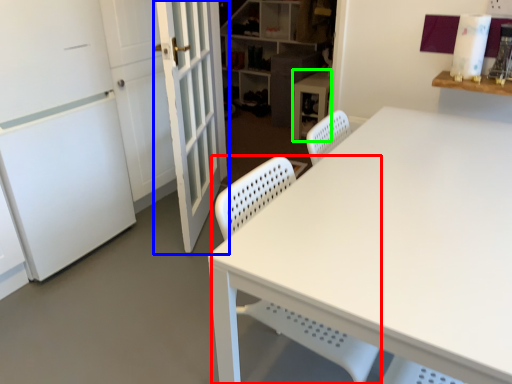
Question: Estimate the real-world distances between objects in this image. Which object is closer to swivel chair (highlighted by a red box), door (highlighted by a blue box) or computer desk (highlighted by a green box)?

Choices:
 (A) door
 (B) computer desk

Answer: (A)